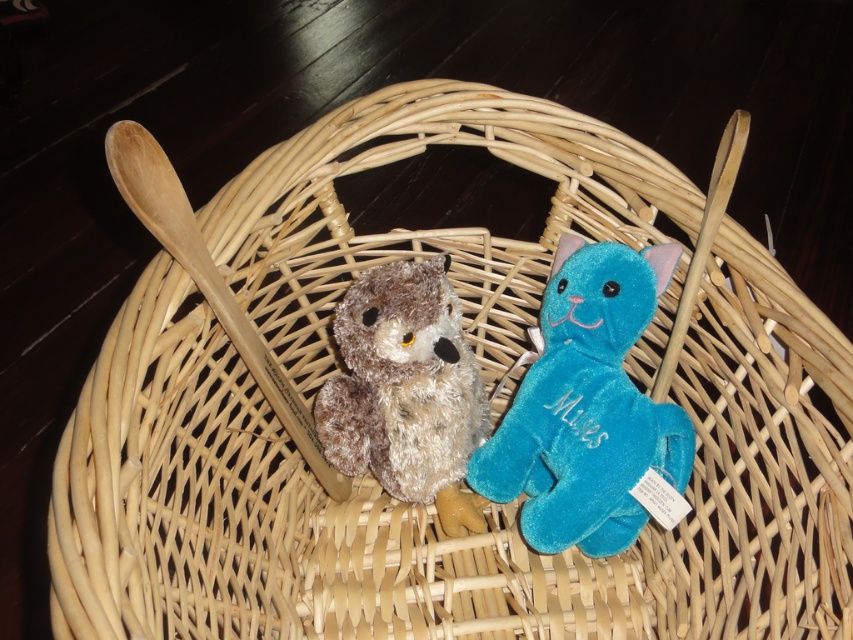
Question: Is velvet blue cat at center to the right of fuzzy brown owl at center from the viewer's perspective?

Choices:
 (A) yes
 (B) no

Answer: (A)

Question: Is velvet blue cat at center to the right of fuzzy brown owl at center from the viewer's perspective?

Choices:
 (A) no
 (B) yes

Answer: (B)

Question: Which of the following is the closest to the observer?

Choices:
 (A) velvet blue cat at center
 (B) fuzzy brown owl at center

Answer: (A)

Question: Does velvet blue cat at center have a smaller size compared to fuzzy brown owl at center?

Choices:
 (A) yes
 (B) no

Answer: (A)

Question: Which object is farther from the camera taking this photo?

Choices:
 (A) velvet blue cat at center
 (B) fuzzy brown owl at center

Answer: (B)